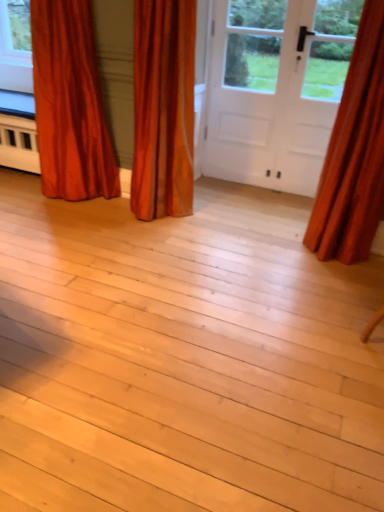
Question: Could white matte door at center be considered to be inside satin orange curtain at right, arranged as the 1th curtain when viewed from the right?

Choices:
 (A) no
 (B) yes

Answer: (A)

Question: From the image's perspective, is satin orange curtain at right, which is the third curtain from left to right, below white matte door at center?

Choices:
 (A) no
 (B) yes

Answer: (B)

Question: Are satin orange curtain at right, which is the third curtain from left to right, and white matte door at center beside each other?

Choices:
 (A) yes
 (B) no

Answer: (B)

Question: From a real-world perspective, is satin orange curtain at right, which is the third curtain from left to right, on white matte door at center?

Choices:
 (A) yes
 (B) no

Answer: (A)

Question: Does satin orange curtain at right, which is the third curtain from left to right, have a lesser width compared to white matte door at center?

Choices:
 (A) no
 (B) yes

Answer: (A)

Question: From a real-world perspective, is velvet orange curtain at left, marked as the first curtain in a left-to-right arrangement, physically located above or below satin orange curtain at right, which is the third curtain from left to right?

Choices:
 (A) below
 (B) above

Answer: (A)

Question: From the image's perspective, relative to satin orange curtain at right, arranged as the 1th curtain when viewed from the right, is velvet orange curtain at left, which appears as the third curtain when viewed from the right, above or below?

Choices:
 (A) below
 (B) above

Answer: (B)

Question: Considering their positions, is velvet orange curtain at left, which appears as the third curtain when viewed from the right, located in front of or behind satin orange curtain at right, which is the third curtain from left to right?

Choices:
 (A) behind
 (B) front

Answer: (A)

Question: Is velvet orange curtain at left, marked as the first curtain in a left-to-right arrangement, wider or thinner than satin orange curtain at right, arranged as the 1th curtain when viewed from the right?

Choices:
 (A) thin
 (B) wide

Answer: (B)

Question: From a real-world perspective, is satin orange curtain at center, acting as the 2th curtain starting from the left, above or below satin orange curtain at right, which is the third curtain from left to right?

Choices:
 (A) below
 (B) above

Answer: (A)

Question: From their relative heights in the image, would you say satin orange curtain at center, acting as the 2th curtain starting from the left, is taller or shorter than satin orange curtain at right, which is the third curtain from left to right?

Choices:
 (A) tall
 (B) short

Answer: (B)

Question: From the image's perspective, is satin orange curtain at center, the 2th curtain viewed from the right, located above or below satin orange curtain at right, which is the third curtain from left to right?

Choices:
 (A) above
 (B) below

Answer: (A)

Question: Based on their sizes in the image, would you say satin orange curtain at center, the 2th curtain viewed from the right, is bigger or smaller than satin orange curtain at right, which is the third curtain from left to right?

Choices:
 (A) big
 (B) small

Answer: (A)

Question: Does point (359, 234) appear closer or farther from the camera than point (142, 25)?

Choices:
 (A) farther
 (B) closer

Answer: (B)

Question: Relative to satin orange curtain at center, acting as the 2th curtain starting from the left, is satin orange curtain at right, which is the third curtain from left to right, in front or behind?

Choices:
 (A) behind
 (B) front

Answer: (B)